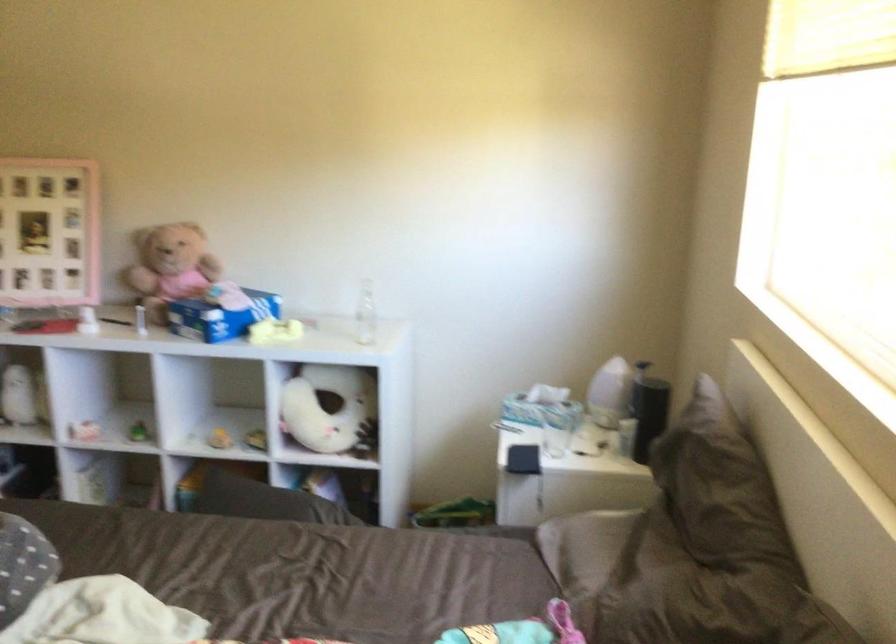
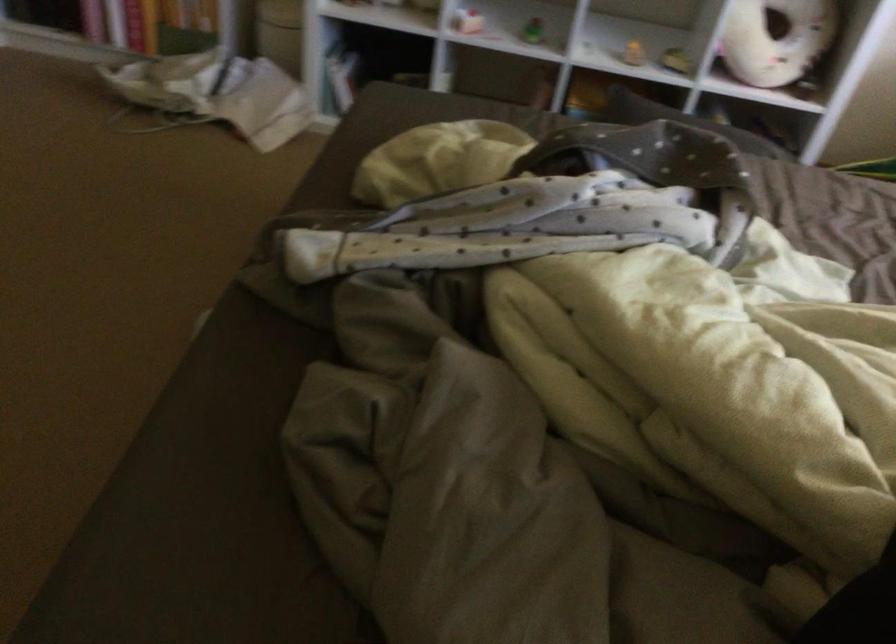
In the second image, find the point that corresponds to (x=326, y=428) in the first image.

(777, 40)